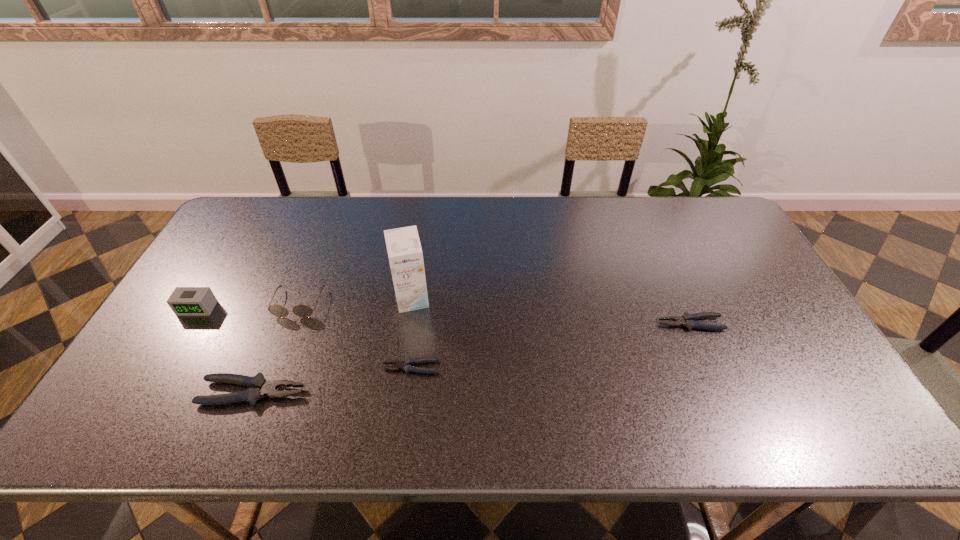
The width and height of the screenshot is (960, 540). Find the location of `free point between the fourth tallest object and the shortest pliers`. free point between the fourth tallest object and the shortest pliers is located at coordinates (332, 380).

Where is `vacant area between the fifth farthest object and the nearest pliers`? The height and width of the screenshot is (540, 960). vacant area between the fifth farthest object and the nearest pliers is located at coordinates (332, 380).

Where is `free point between the rightmost pliers and the leftmost object`? free point between the rightmost pliers and the leftmost object is located at coordinates (444, 316).

Locate an element on the screen. object that stands as the fifth closest to the alarm clock is located at coordinates tap(687, 320).

The width and height of the screenshot is (960, 540). Find the location of `object that stands as the fifth closest to the farthest pliers`. object that stands as the fifth closest to the farthest pliers is located at coordinates (184, 301).

The width and height of the screenshot is (960, 540). In order to click on pliers that is the third closest one to the alarm clock in this screenshot , I will do `click(687, 320)`.

You are a GUI agent. You are given a task and a screenshot of the screen. Output one action in this format:
    pyautogui.click(x=<x>, y=<y>)
    Task: Click on the pliers that is the closest to the nearest pliers
    The width and height of the screenshot is (960, 540).
    Given the screenshot: What is the action you would take?
    pyautogui.click(x=405, y=365)